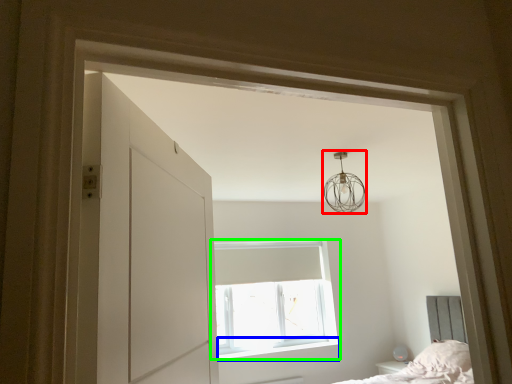
Question: Which is farther away from lamp (highlighted by a red box)? window sill (highlighted by a blue box) or window (highlighted by a green box)?

Choices:
 (A) window sill
 (B) window

Answer: (A)